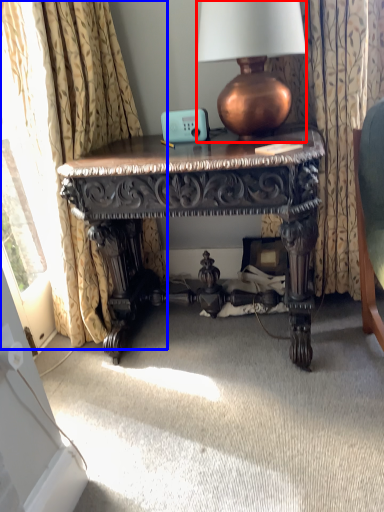
Question: Which point is closer to the camera, lamp (highlighted by a red box) or curtain (highlighted by a blue box)?

Choices:
 (A) lamp
 (B) curtain

Answer: (B)